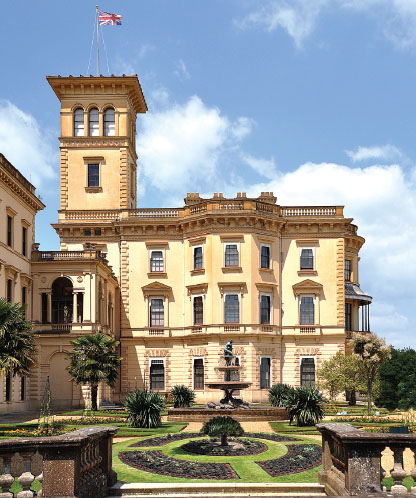
At what (x,y) coordinates should I click in order to perform the action: click on window. Please return your answer as a coordinate pair (x, y). Looking at the image, I should click on (160, 310).